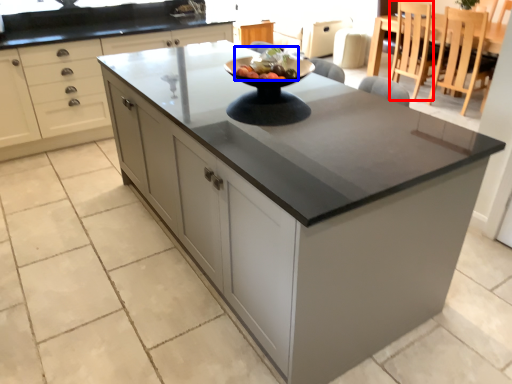
Question: Which object appears farthest to the camera in this image, chair (highlighted by a red box) or fruit salad (highlighted by a blue box)?

Choices:
 (A) chair
 (B) fruit salad

Answer: (A)